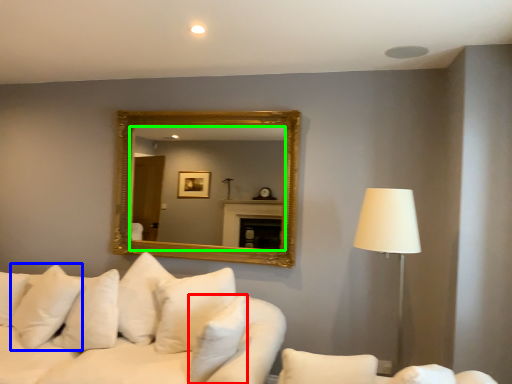
Question: Which object is the closest to the pillow (highlighted by a red box)? Choose among these: pillow (highlighted by a blue box) or mirror (highlighted by a green box).

Choices:
 (A) pillow
 (B) mirror

Answer: (A)